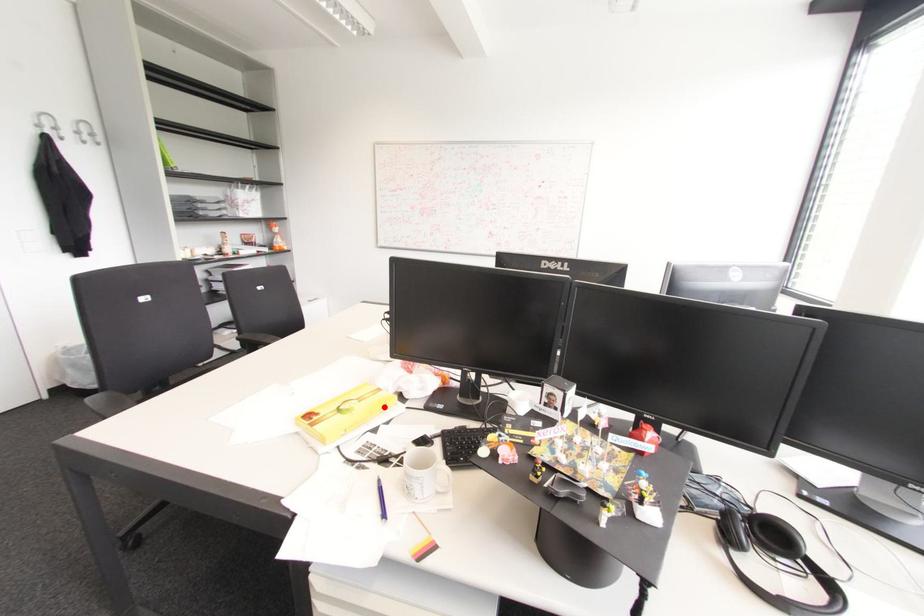
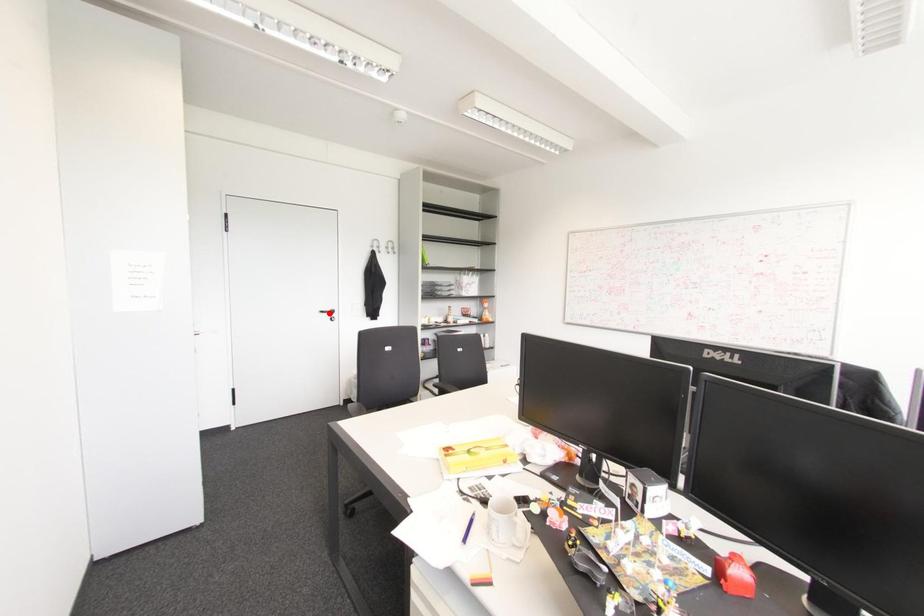
I am providing you with two images of the same scene from different viewpoints. A red point is marked on the first image and another point is marked on the second image. Are the points marked in image1 and image2 representing the same 3D position?

No